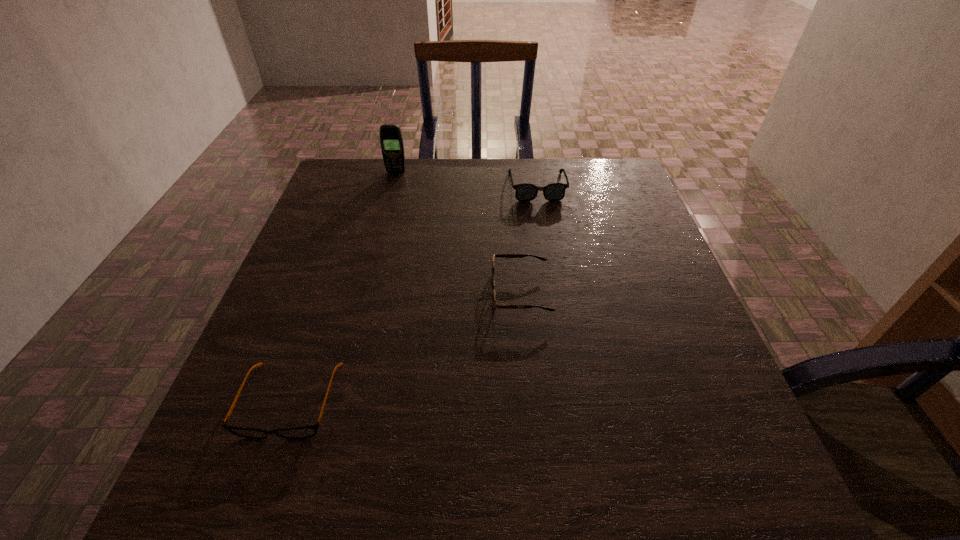
Locate an element on the screen. Image resolution: width=960 pixels, height=540 pixels. vacant space that's between the shortest object and the farthest spectacles is located at coordinates (414, 294).

Locate an element on the screen. The width and height of the screenshot is (960, 540). empty space between the leftmost spectacles and the cellular telephone is located at coordinates (343, 287).

Identify which object is the third nearest to the leftmost spectacles. Please provide its 2D coordinates. Your answer should be formatted as a tuple, i.e. [(x, y)], where the tuple contains the x and y coordinates of a point satisfying the conditions above.

[(391, 140)]

Point out which object is positioned as the second nearest to the nearest spectacles. Please provide its 2D coordinates. Your answer should be formatted as a tuple, i.e. [(x, y)], where the tuple contains the x and y coordinates of a point satisfying the conditions above.

[(555, 191)]

Locate which spectacles is the closest to the cellular telephone. Please provide its 2D coordinates. Your answer should be formatted as a tuple, i.e. [(x, y)], where the tuple contains the x and y coordinates of a point satisfying the conditions above.

[(555, 191)]

This screenshot has width=960, height=540. Find the location of `spectacles that is the closest to the tallest object`. spectacles that is the closest to the tallest object is located at coordinates (555, 191).

Image resolution: width=960 pixels, height=540 pixels. I want to click on vacant point that satisfies the following two spatial constraints: 1. on the face of the farthest spectacles; 2. on the frame of the third farthest object, so click(x=555, y=293).